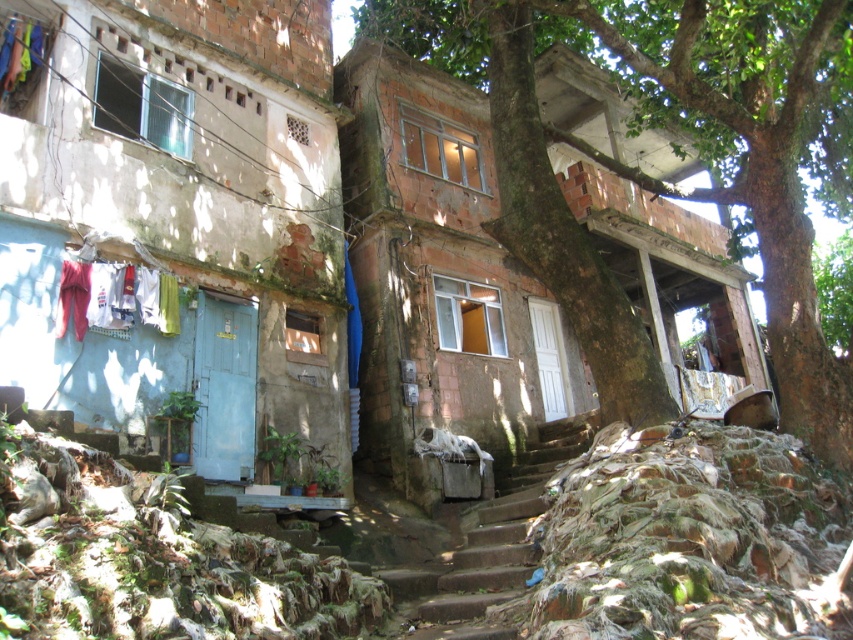
Question: Which point is farther to the camera?

Choices:
 (A) multicolored fabric at upper left
 (B) rusty concrete stairs at center

Answer: (A)

Question: Is brown rough bark tree at center smaller than rusty concrete stairs at center?

Choices:
 (A) yes
 (B) no

Answer: (B)

Question: Where is white fabric at left located in relation to multicolored fabric at upper left in the image?

Choices:
 (A) below
 (B) above

Answer: (A)

Question: Is rusty concrete stairs at center to the right of multicolored fabric at upper left from the viewer's perspective?

Choices:
 (A) yes
 (B) no

Answer: (A)

Question: Which object is farther from the camera taking this photo?

Choices:
 (A) white fabric at left
 (B) brown rough bark tree at center

Answer: (A)

Question: Which object appears farthest from the camera in this image?

Choices:
 (A) multicolored fabric at upper left
 (B) white fabric at left

Answer: (A)